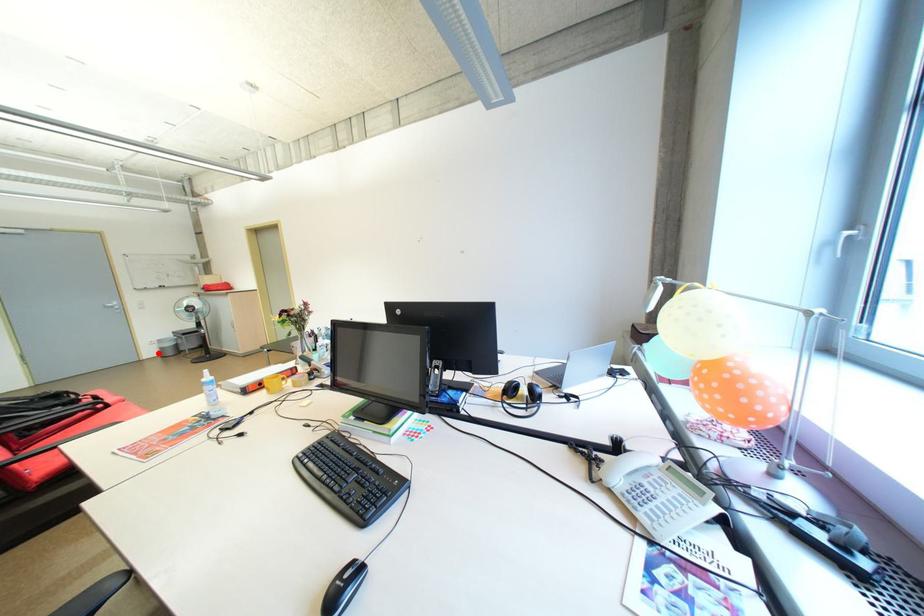
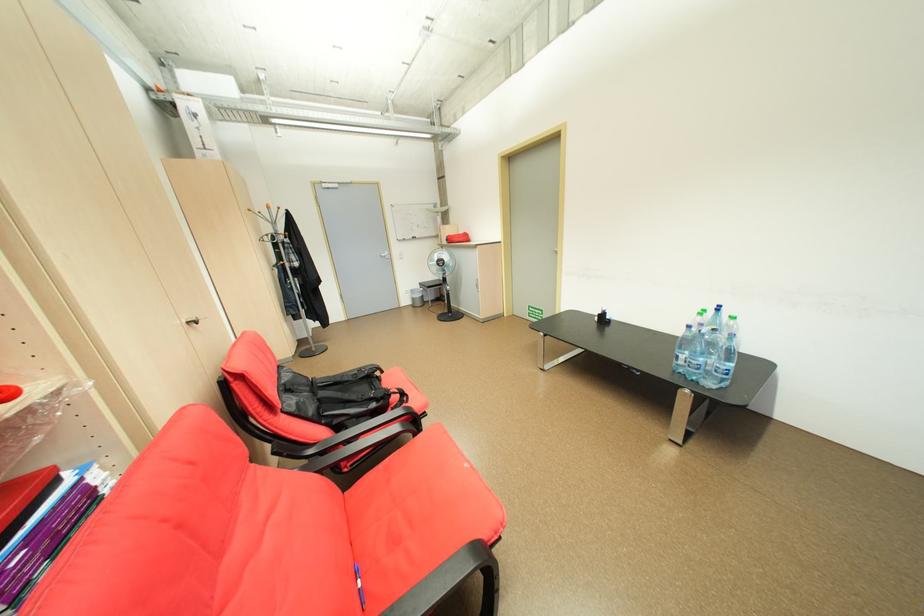
Question: A red point is marked in image1. In image2, is the corresponding 3D point closer to the camera or farther? Reply with the corresponding letter.

Choices:
 (A) The corresponding 3D point is closer.
 (B) The corresponding 3D point is farther.

Answer: (A)